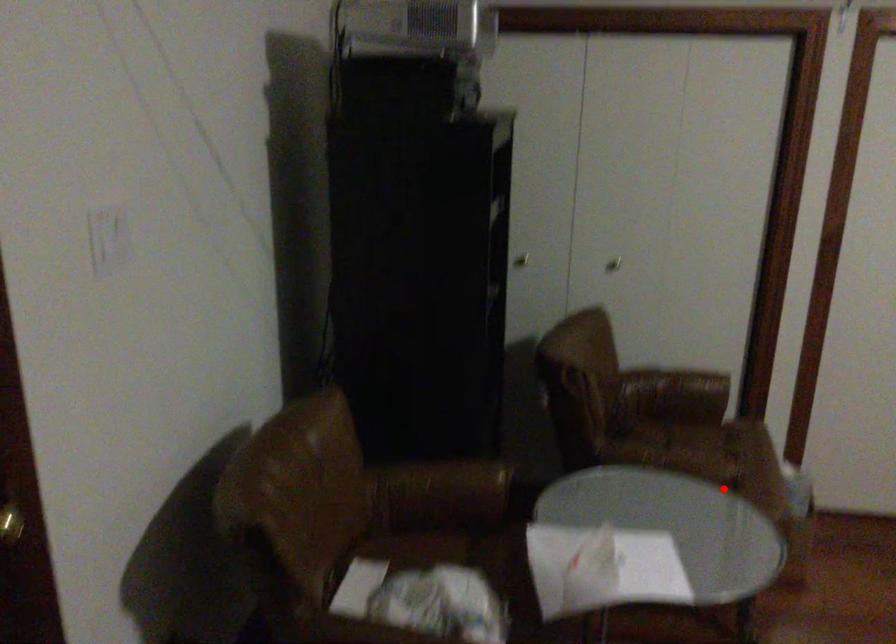
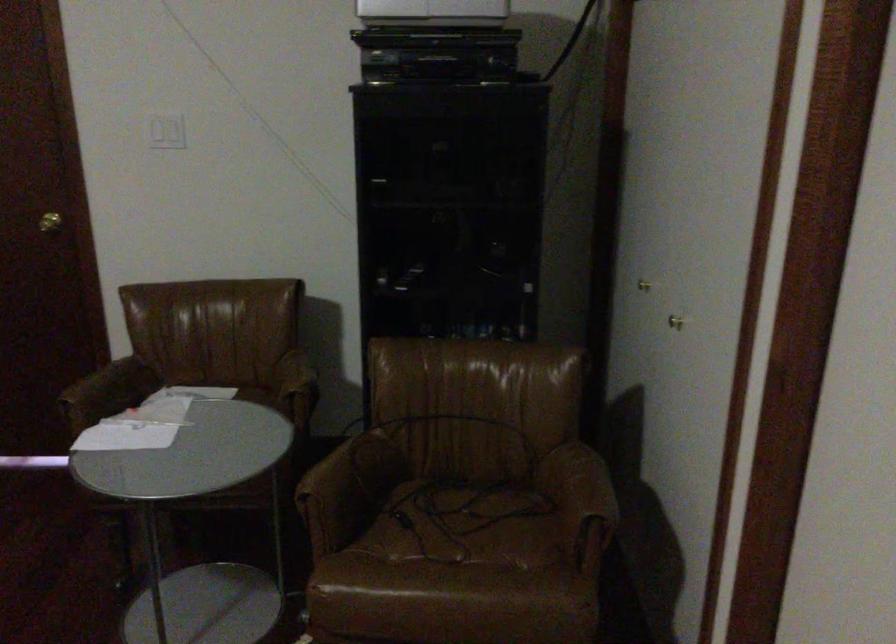
Question: I am providing you with two images of the same scene from different viewpoints. A red point is shown in image1. For the corresponding object point in image2, is it positioned nearer or farther from the camera?

Choices:
 (A) Nearer
 (B) Farther

Answer: (A)